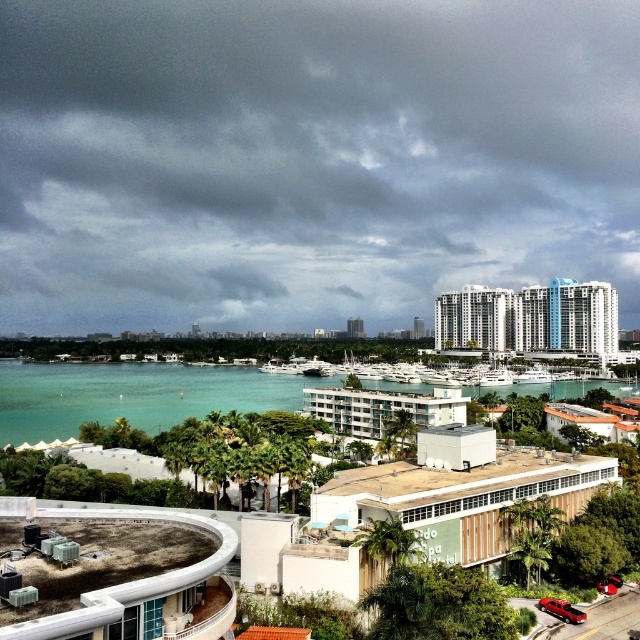
You are standing at the do spa hotel and want to take a photo of both the point at coordinates point (77, 412) and the point at coordinates point (440, 416). Which point should you focus on first to ensure both are in the frame?

Since point (77, 412) is closer to you than point (440, 416), you should focus on point (77, 412) first to ensure both are within the camera frame.

What are the coordinates of the dark gray cloud at upper center in the image?

The dark gray cloud at upper center is located at coordinates point (308, 157).

You are standing at the center of the coastal urban area and want to take a photo of the concrete roof at lower left and the white glossy building at upper right. Which one of these two objects will appear larger in the photo?

The white glossy building at upper right will appear larger in the photo because it is taller than the concrete roof at lower left.